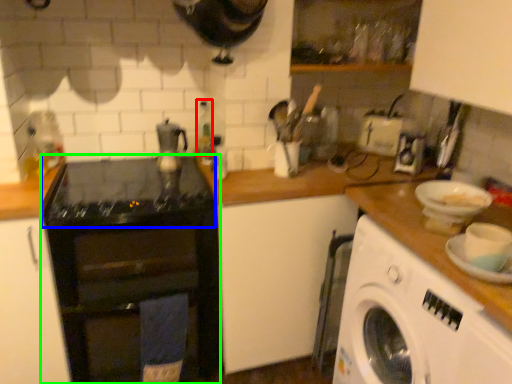
Question: Based on their relative distances, which object is nearer to bottle (highlighted by a red box)? Choose from gas stove (highlighted by a blue box) and home appliance (highlighted by a green box).

Choices:
 (A) gas stove
 (B) home appliance

Answer: (A)